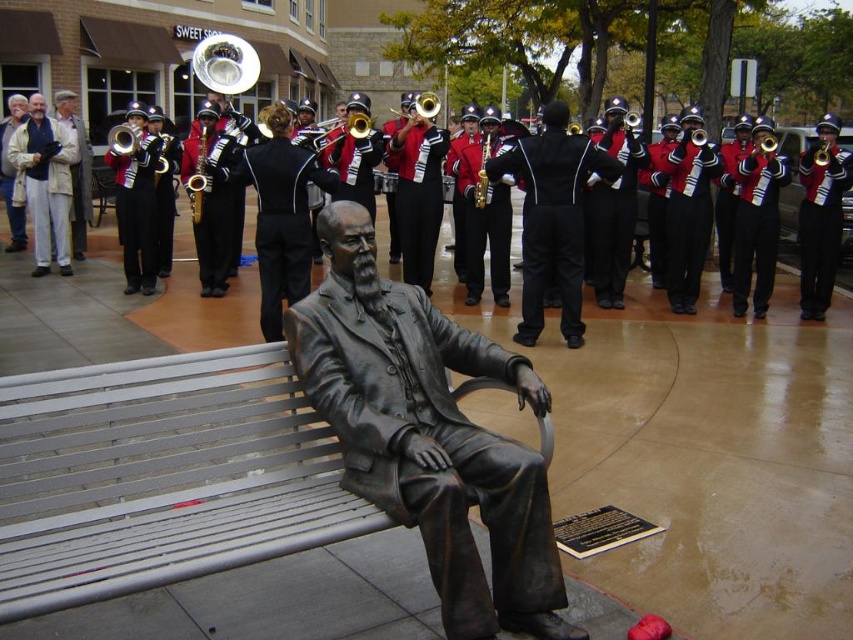
Can you confirm if silver metallic bench at center is taller than shiny gold trumpet at center?

No.

Is point (300, 508) more distant than point (801, 230)?

That is False.

Identify the location of silver metallic bench at center. The width and height of the screenshot is (853, 640). (161, 476).

Between bronze statue at center and brass saxophone at center, which one appears on the left side from the viewer's perspective?

brass saxophone at center is more to the left.

Can you confirm if bronze statue at center is positioned to the right of brass saxophone at center?

Yes, bronze statue at center is to the right of brass saxophone at center.

The height and width of the screenshot is (640, 853). In order to click on bronze statue at center in this screenshot , I will do `click(428, 435)`.

Where is `bronze statue at center`? Image resolution: width=853 pixels, height=640 pixels. bronze statue at center is located at coordinates (428, 435).

Between bronze statue at center and bronze saxophone at center, which one has less height?

With less height is bronze saxophone at center.

Locate an element on the screen. bronze statue at center is located at coordinates (428, 435).